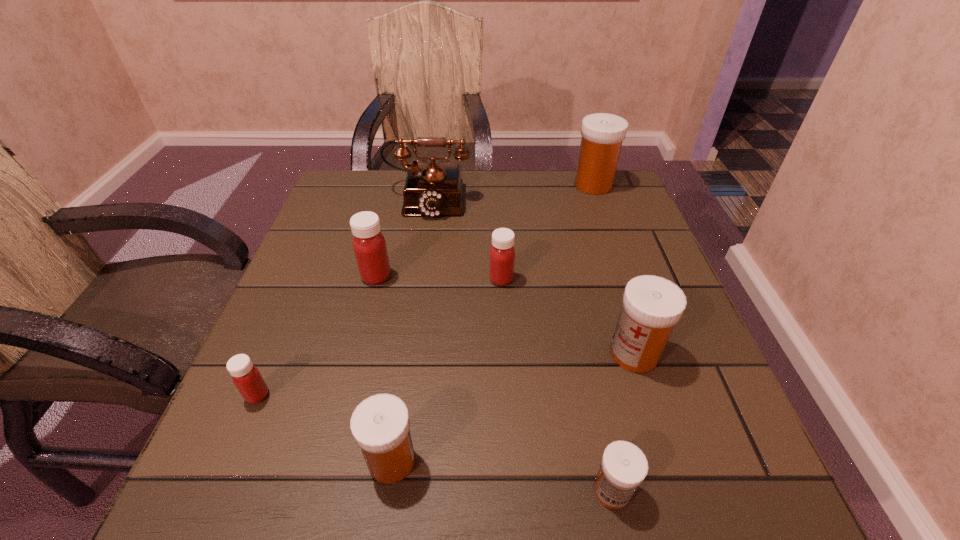
This screenshot has width=960, height=540. Find the location of `free location at the left edge`. free location at the left edge is located at coordinates (276, 346).

Identify the location of vacant space at the right edge of the desktop. (608, 258).

The image size is (960, 540). Identify the location of vacant area at the near left corner. (267, 472).

Identify the location of free space between the second red medicine from right to left and the leftmost white medicine. This screenshot has width=960, height=540. (384, 369).

At what (x,y) coordinates should I click in order to perform the action: click on vacant point located between the farthest white medicine and the telephone. Please return your answer as a coordinate pair (x, y). Looking at the image, I should click on (511, 191).

The image size is (960, 540). What are the coordinates of `vacant area between the leftmost object and the fifth object from left to right` in the screenshot? It's located at (379, 337).

Locate an element on the screen. free spot between the leftmost red medicine and the fourth medicine from left to right is located at coordinates (379, 337).

The width and height of the screenshot is (960, 540). What are the coordinates of `empty space between the second farthest white medicine and the rightmost red medicine` in the screenshot? It's located at (567, 316).

You are a GUI agent. You are given a task and a screenshot of the screen. Output one action in this format:
    pyautogui.click(x=<x>, y=<y>)
    Task: Click on the free spot between the rightmost red medicine and the farthest medicine
    
    Given the screenshot: What is the action you would take?
    pyautogui.click(x=547, y=232)

This screenshot has height=540, width=960. Find the location of `vacant area that lies between the brown telephone and the third object from right to left`. vacant area that lies between the brown telephone and the third object from right to left is located at coordinates (520, 344).